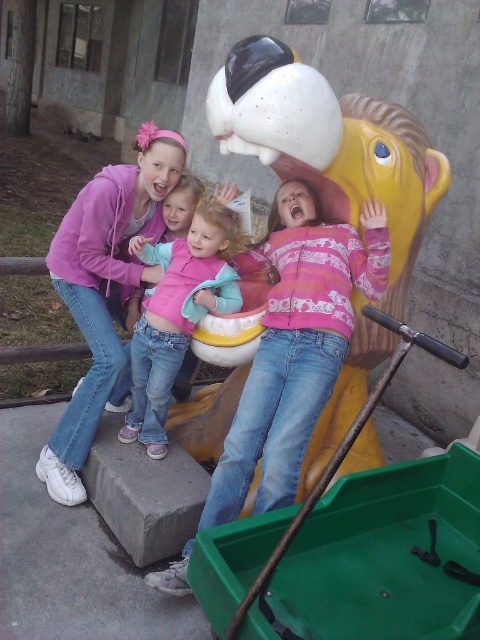
Question: Which object is farther from the camera taking this photo?

Choices:
 (A) pink fleece jacket at center
 (B) matte pink hoodie at center
 (C) pink fleece jacket at upper center

Answer: (B)

Question: Is pink fleece jacket at center smaller than matte pink hoodie at center?

Choices:
 (A) yes
 (B) no

Answer: (B)

Question: Which object appears farthest from the camera in this image?

Choices:
 (A) matte pink hoodie at center
 (B) pink fleece jacket at upper center
 (C) pink fleece jacket at center

Answer: (A)

Question: Is matte pink hoodie at center to the left of pink fleece jacket at upper center from the viewer's perspective?

Choices:
 (A) no
 (B) yes

Answer: (B)

Question: Can you confirm if pink fleece jacket at center is positioned to the left of matte pink hoodie at center?

Choices:
 (A) yes
 (B) no

Answer: (B)

Question: Among these points, which one is nearest to the camera?

Choices:
 (A) (73, 307)
 (B) (228, 288)
 (C) (266, 385)

Answer: (C)